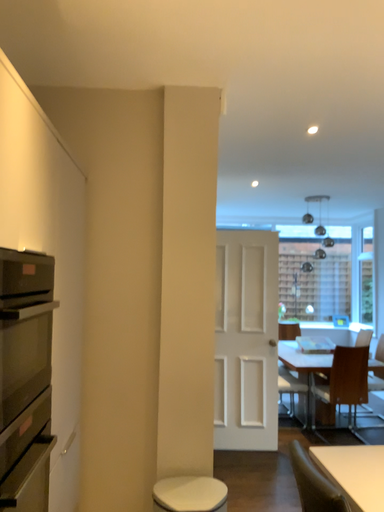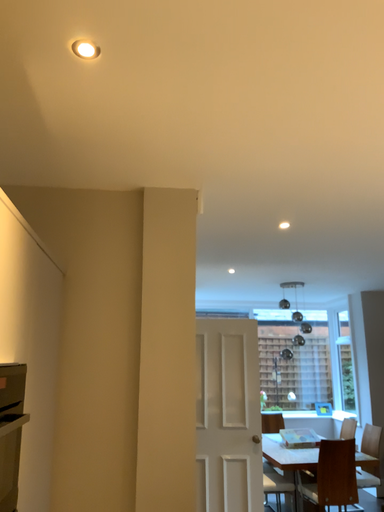
Question: Which way did the camera rotate in the video?

Choices:
 (A) rotated downward
 (B) rotated upward

Answer: (B)